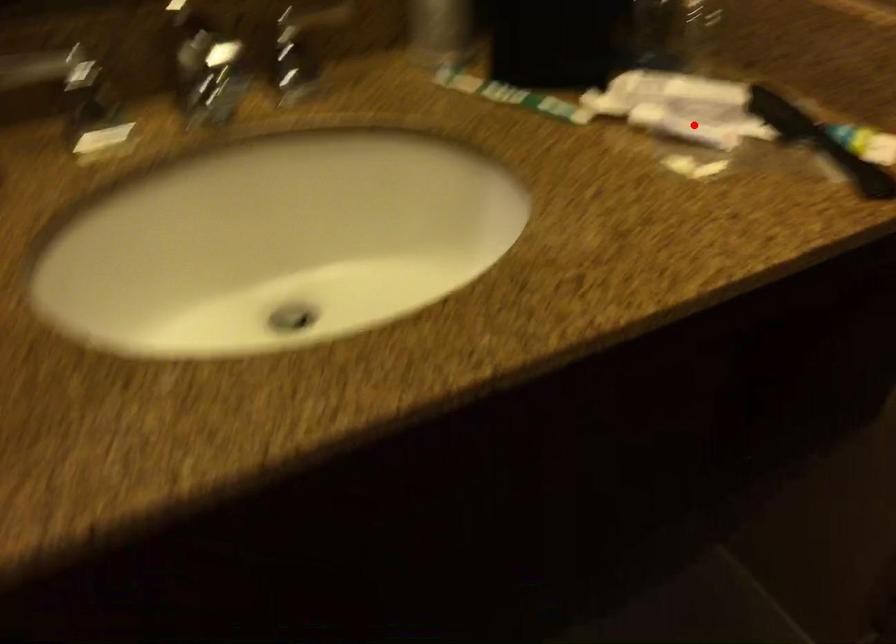
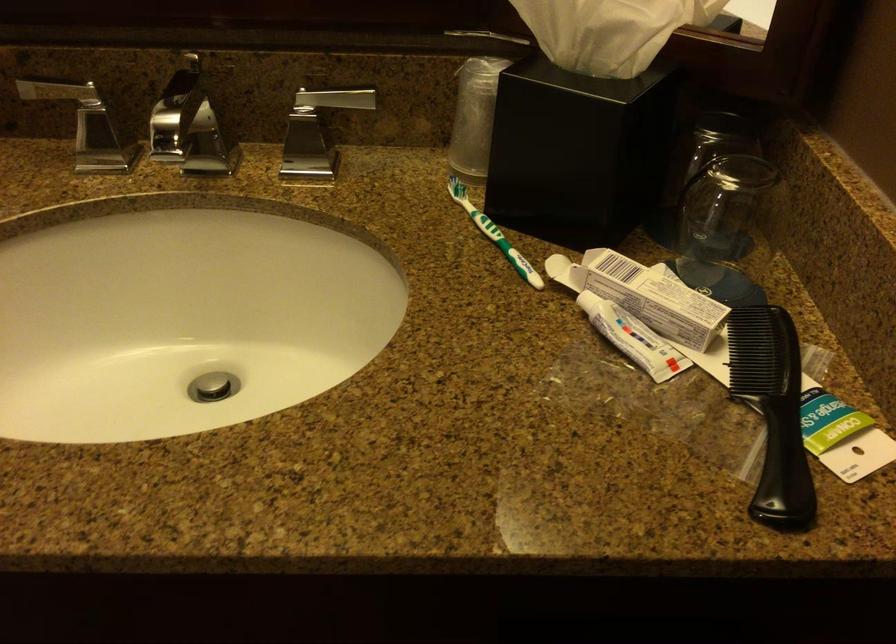
Question: I am providing you with two images of the same scene from different viewpoints. A red point is marked on the first image. Is the red point's position out of view in image 2?

Choices:
 (A) Yes
 (B) No

Answer: (B)